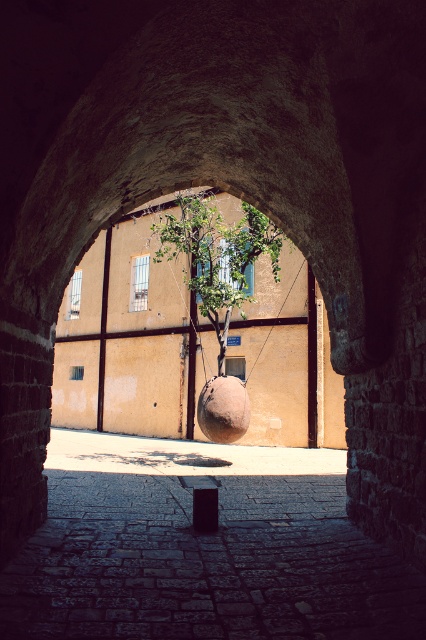
Question: Considering the relative positions of smooth stone alley at center and green leafy tree at center in the image provided, where is smooth stone alley at center located with respect to green leafy tree at center?

Choices:
 (A) right
 (B) left

Answer: (B)

Question: Is smooth stone alley at center closer to the viewer compared to green leafy tree at center?

Choices:
 (A) yes
 (B) no

Answer: (A)

Question: From the image, what is the correct spatial relationship of smooth stone alley at center in relation to green leafy tree at center?

Choices:
 (A) above
 (B) below

Answer: (B)

Question: Among these points, which one is farthest from the camera?

Choices:
 (A) (206, 316)
 (B) (259, 593)

Answer: (A)

Question: Which of the following is the closest to the observer?

Choices:
 (A) (169, 257)
 (B) (319, 531)

Answer: (B)